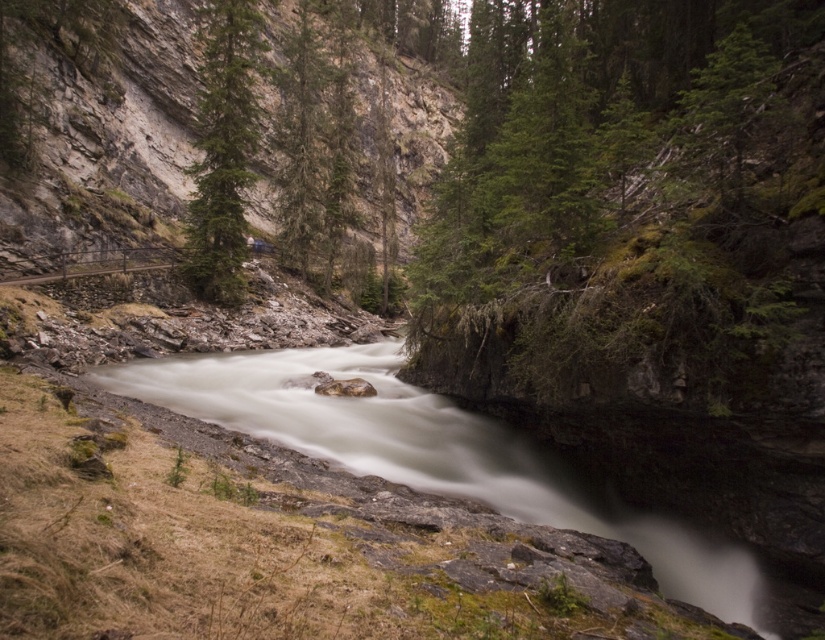
Can you confirm if green matte tree at upper center is positioned to the left of green textured tree at center?

Indeed, green matte tree at upper center is positioned on the left side of green textured tree at center.

Does green matte tree at upper center have a smaller size compared to green textured tree at center?

No.

Is point (211, 116) farther from camera compared to point (310, 140)?

No, (211, 116) is in front of (310, 140).

This screenshot has height=640, width=825. Identify the location of green matte tree at upper center. (224, 148).